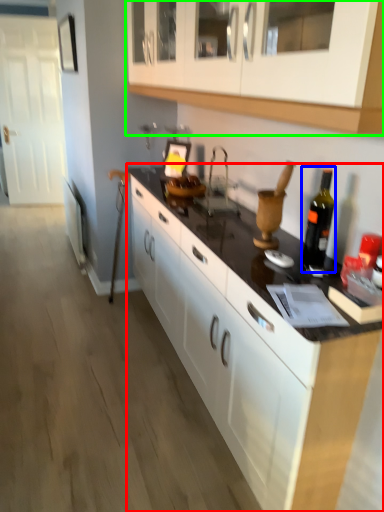
Question: Which is nearer to the countertop (highlighted by a red box)? bottle (highlighted by a blue box) or cabinetry (highlighted by a green box).

Choices:
 (A) bottle
 (B) cabinetry

Answer: (A)